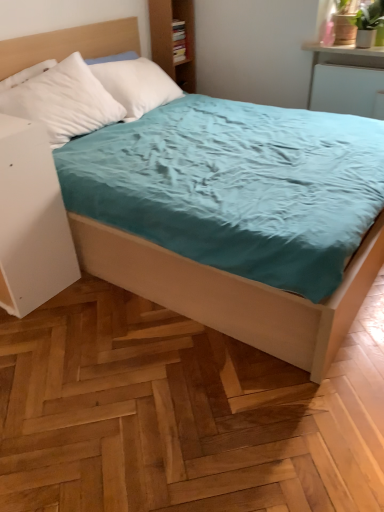
Question: Considering the positions of white matte nightstand at left and white glossy shelf at upper right in the image, is white matte nightstand at left wider or thinner than white glossy shelf at upper right?

Choices:
 (A) thin
 (B) wide

Answer: (A)

Question: From a real-world perspective, relative to white glossy shelf at upper right, is white matte nightstand at left vertically above or below?

Choices:
 (A) below
 (B) above

Answer: (A)

Question: In terms of height, does white matte nightstand at left look taller or shorter compared to white glossy shelf at upper right?

Choices:
 (A) tall
 (B) short

Answer: (A)

Question: Considering the positions of white glossy shelf at upper right and white matte nightstand at left in the image, is white glossy shelf at upper right bigger or smaller than white matte nightstand at left?

Choices:
 (A) small
 (B) big

Answer: (A)

Question: Relative to white matte nightstand at left, is white glossy shelf at upper right in front or behind?

Choices:
 (A) behind
 (B) front

Answer: (A)

Question: From the image's perspective, is white glossy shelf at upper right above or below white matte nightstand at left?

Choices:
 (A) above
 (B) below

Answer: (A)

Question: Considering the positions of white glossy shelf at upper right and white matte nightstand at left in the image, is white glossy shelf at upper right taller or shorter than white matte nightstand at left?

Choices:
 (A) tall
 (B) short

Answer: (B)